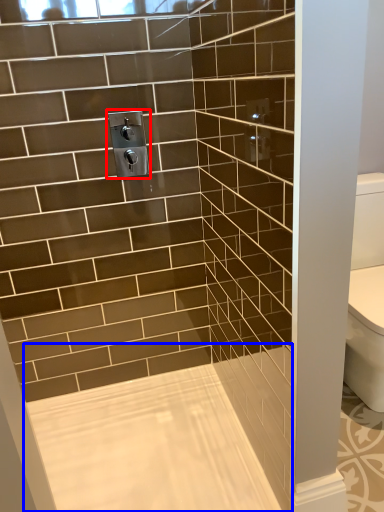
Question: Which of the following is the closest to the observer, plumbing fixture (highlighted by a red box) or bath (highlighted by a blue box)?

Choices:
 (A) plumbing fixture
 (B) bath

Answer: (B)